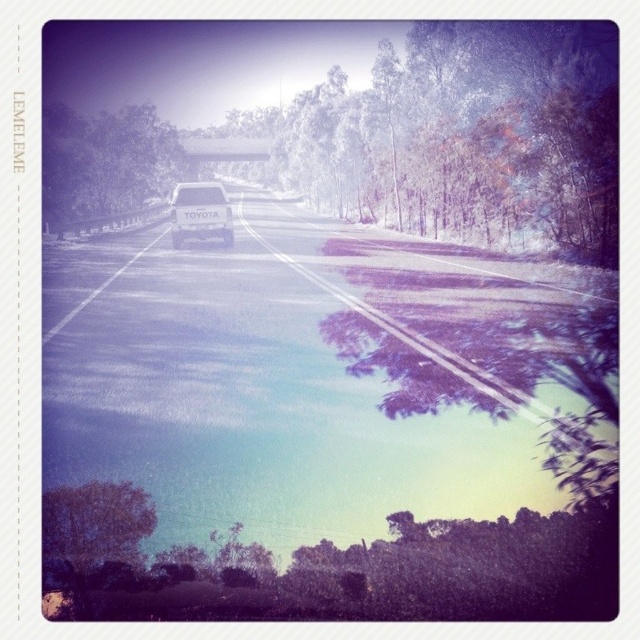
Image resolution: width=640 pixels, height=640 pixels. Describe the element at coordinates (104, 163) in the screenshot. I see `green leafy tree at left` at that location.

Is point (70, 122) positioned behind point (193, 218)?

Yes, point (70, 122) is farther from viewer.

Who is more forward, [42,140] or [220,198]?

Point [220,198] is in front.

The image size is (640, 640). What are the coordinates of `green leafy tree at left` in the screenshot? It's located at (104, 163).